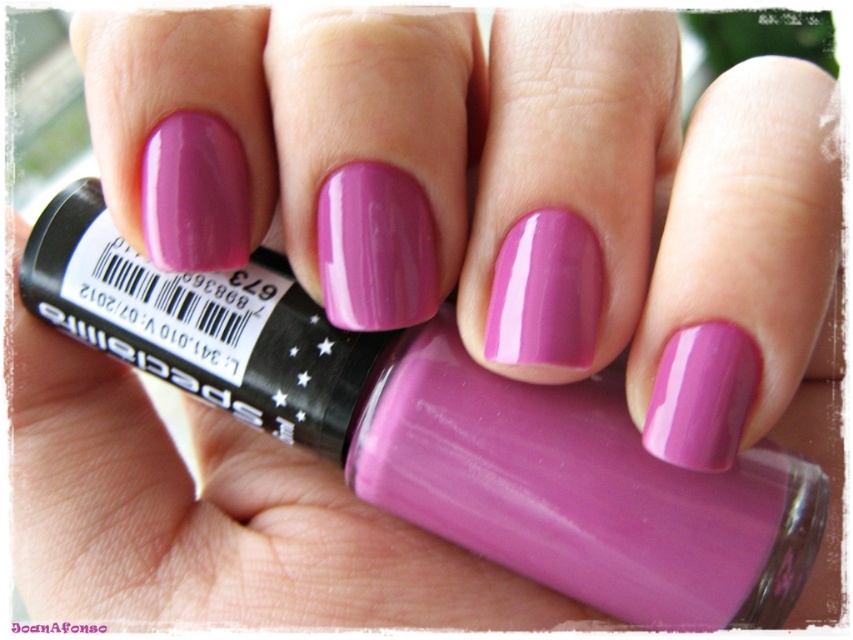
Question: Does matte purple nail polish at center have a larger size compared to glossy purple nail polish at center?

Choices:
 (A) no
 (B) yes

Answer: (B)

Question: Which object appears closest to the camera in this image?

Choices:
 (A) matte purple nail polish at center
 (B) glossy purple nail polish at center

Answer: (B)

Question: Can you confirm if matte purple nail polish at center is wider than glossy purple nail polish at center?

Choices:
 (A) no
 (B) yes

Answer: (B)

Question: Which point is closer to the camera taking this photo?

Choices:
 (A) (242, 250)
 (B) (352, 474)

Answer: (A)

Question: Does matte purple nail polish at center appear under glossy purple nail polish at center?

Choices:
 (A) no
 (B) yes

Answer: (B)

Question: Which of the following is the closest to the observer?

Choices:
 (A) (683, 582)
 (B) (218, 161)

Answer: (B)